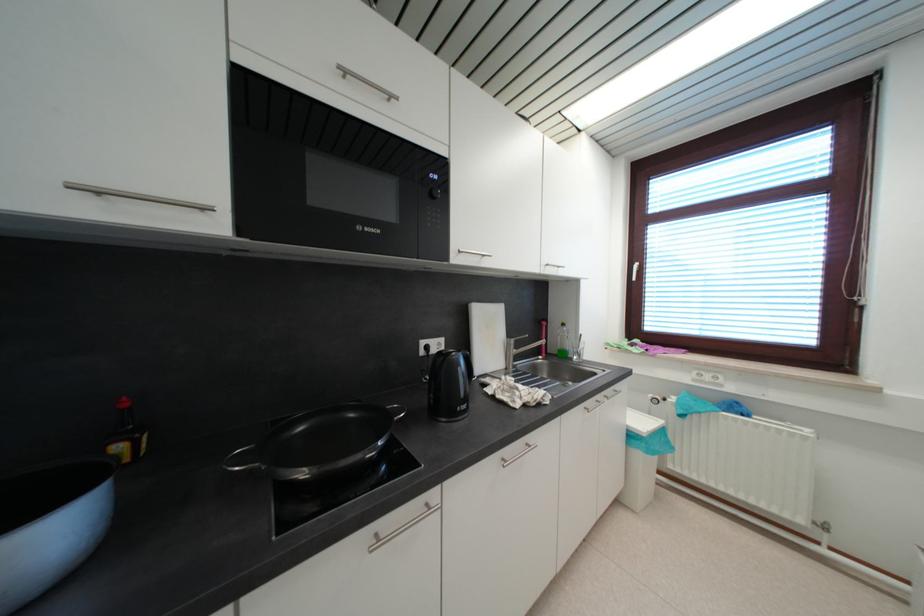
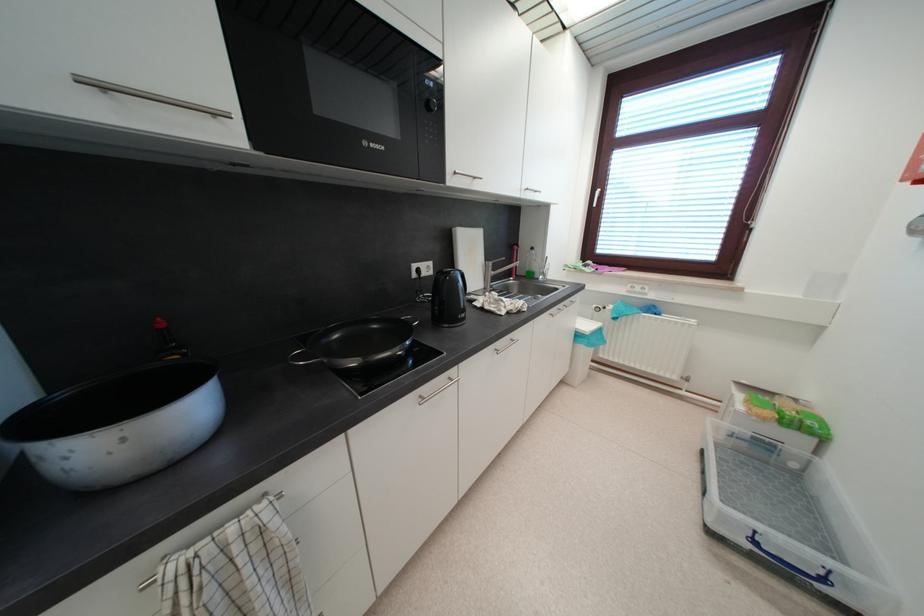
Locate, in the second image, the point that corresponds to (514,338) in the first image.

(492, 261)